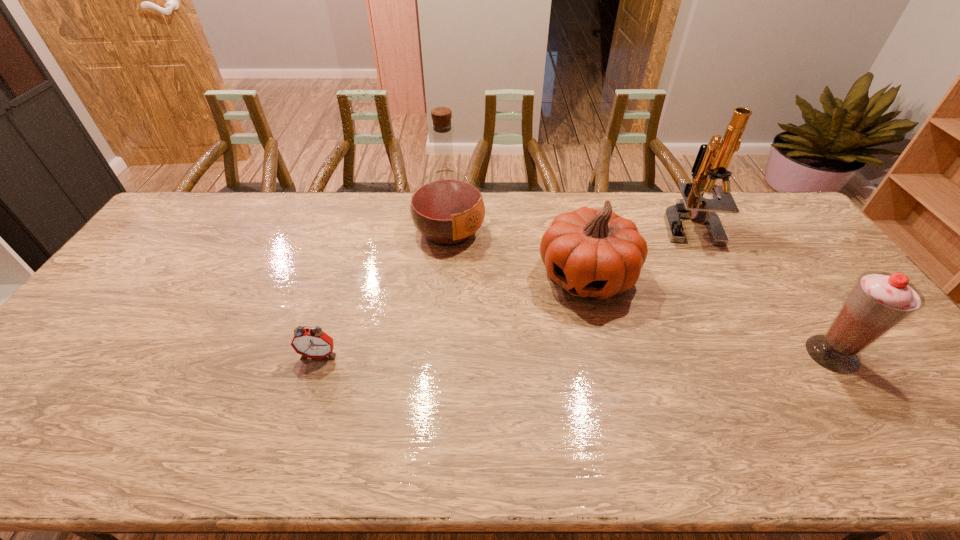
In order to click on the leftmost object in this screenshot , I will do `click(313, 343)`.

In order to click on alarm clock in this screenshot , I will do `click(313, 343)`.

This screenshot has width=960, height=540. In order to click on smoothie in this screenshot , I will do `click(879, 302)`.

Identify the location of the third shortest object. point(879,302).

You are a GUI agent. You are given a task and a screenshot of the screen. Output one action in this format:
    pyautogui.click(x=<x>, y=<y>)
    Task: Click on the fourth object from right to left
    This screenshot has width=960, height=540.
    Given the screenshot: What is the action you would take?
    pyautogui.click(x=447, y=208)

Where is `microscope`? The width and height of the screenshot is (960, 540). microscope is located at coordinates (712, 161).

This screenshot has height=540, width=960. Identify the location of pumpkin. (591, 253).

The width and height of the screenshot is (960, 540). I want to click on the third object from right to left, so click(x=591, y=253).

Find the location of a particular element. The width and height of the screenshot is (960, 540). free space located 0.120m on the clock face of the leftmost object is located at coordinates (303, 404).

The image size is (960, 540). In order to click on free space located 0.050m on the left of the third shortest object in this screenshot , I will do `click(789, 354)`.